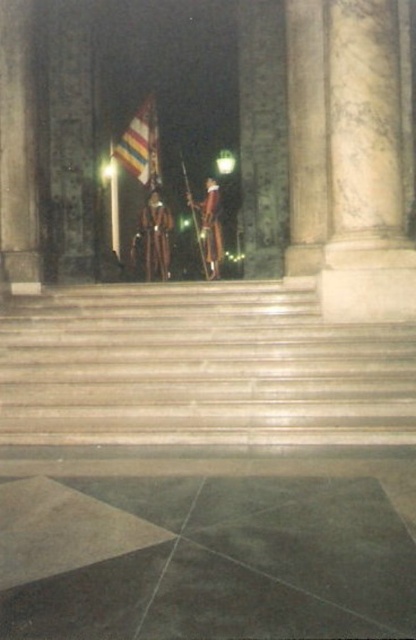
Between smooth stone stairs at center and striped fabric flag at center, which one appears on the right side from the viewer's perspective?

Positioned to the right is smooth stone stairs at center.

Locate an element on the screen. Image resolution: width=416 pixels, height=640 pixels. smooth stone stairs at center is located at coordinates (200, 368).

Who is lower down, striped fabric flag at center or shiny gold uniform at center?

Positioned lower is shiny gold uniform at center.

Is striped fabric flag at center smaller than shiny gold uniform at center?

Incorrect, striped fabric flag at center is not smaller in size than shiny gold uniform at center.

Does point (135, 122) come closer to viewer compared to point (146, 243)?

No, it is behind (146, 243).

Locate an element on the screen. This screenshot has height=640, width=416. striped fabric flag at center is located at coordinates (141, 145).

Can you confirm if shiny gold uniform at center is positioned to the right of shiny gold helmet at center?

No, shiny gold uniform at center is not to the right of shiny gold helmet at center.

Between shiny gold uniform at center and shiny gold helmet at center, which one has more height?

shiny gold uniform at center

Who is more forward, [168,218] or [217,243]?

Positioned in front is point [217,243].

Find the location of a particular element. The image size is (416, 640). shiny gold uniform at center is located at coordinates (156, 234).